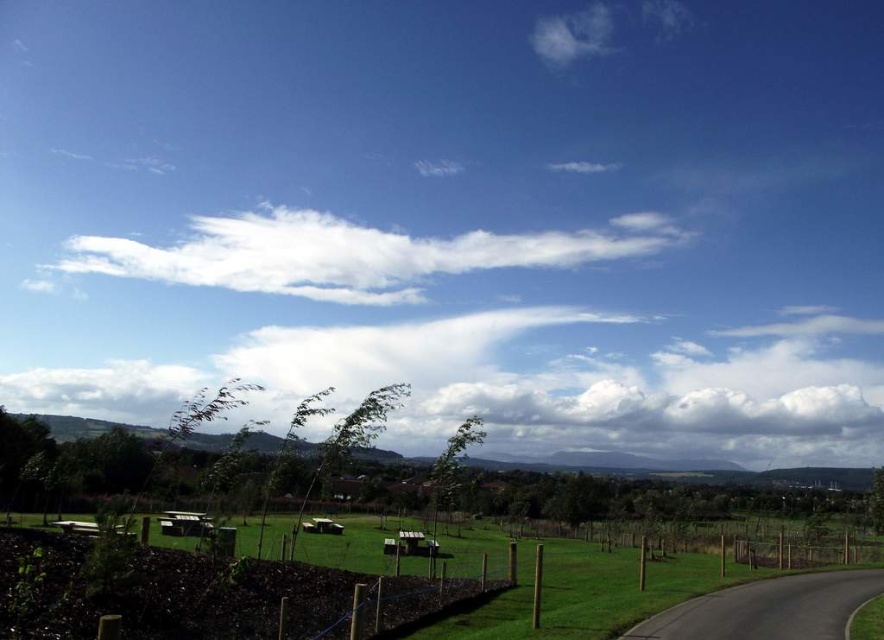
Question: Is green grass at lower center further to camera compared to white fluffy cloud at upper center?

Choices:
 (A) no
 (B) yes

Answer: (A)

Question: Is green grass at lower center bigger than white fluffy cloud at upper center?

Choices:
 (A) yes
 (B) no

Answer: (B)

Question: Which point is farther from the camera taking this photo?

Choices:
 (A) (758, 572)
 (B) (334, 216)

Answer: (B)

Question: Which object is closer to the camera taking this photo?

Choices:
 (A) green grass at lower center
 (B) white fluffy cloud at upper center

Answer: (A)

Question: Where is green grass at lower center located in relation to white fluffy cloud at upper center in the image?

Choices:
 (A) right
 (B) left

Answer: (A)